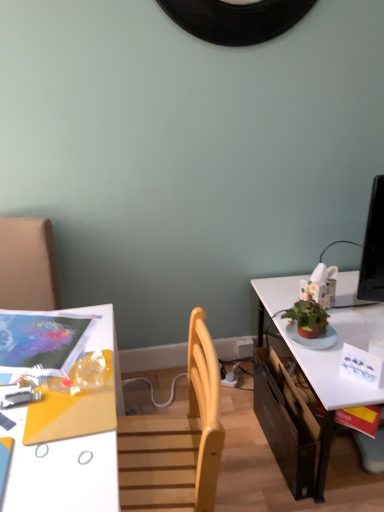
Image resolution: width=384 pixels, height=512 pixels. I want to click on vacant region above matte plastic magazine at upper left (from a real-world perspective), so click(x=35, y=330).